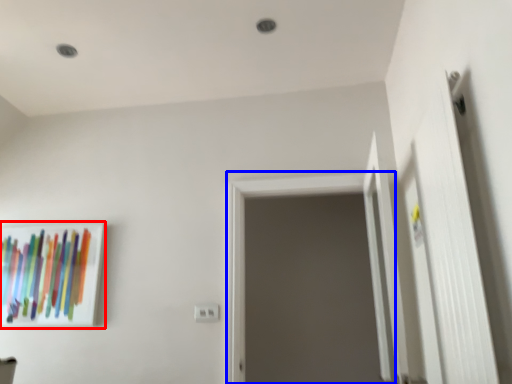
Question: Which object is closer to the camera taking this photo, picture frame (highlighted by a red box) or screen door (highlighted by a blue box)?

Choices:
 (A) picture frame
 (B) screen door

Answer: (B)